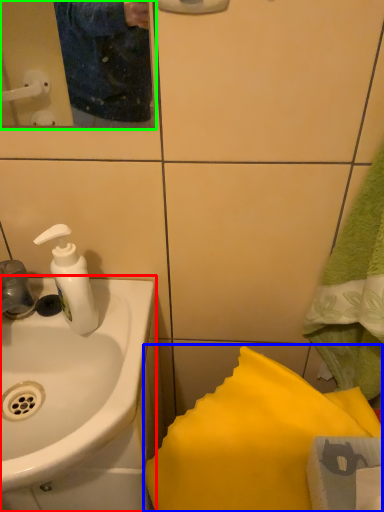
Question: Considering the real-world distances, which object is closest to sink (highlighted by a red box)? bath towel (highlighted by a blue box) or mirror (highlighted by a green box).

Choices:
 (A) bath towel
 (B) mirror

Answer: (A)